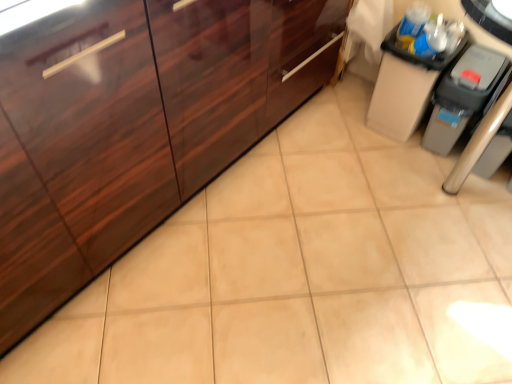
Identify the location of free space in front of gray plastic trash can at right. The image size is (512, 384). (446, 181).